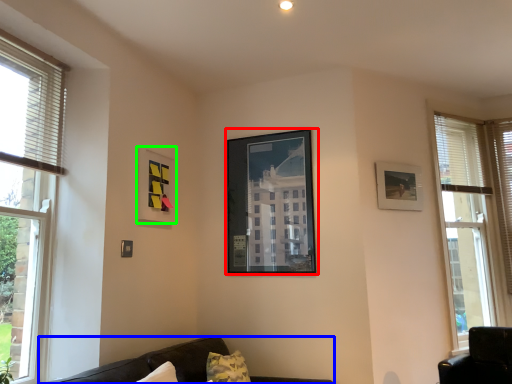
Question: Which is nearer to the picture frame (highlighted by a red box)? studio couch (highlighted by a blue box) or picture frame (highlighted by a green box).

Choices:
 (A) studio couch
 (B) picture frame

Answer: (B)